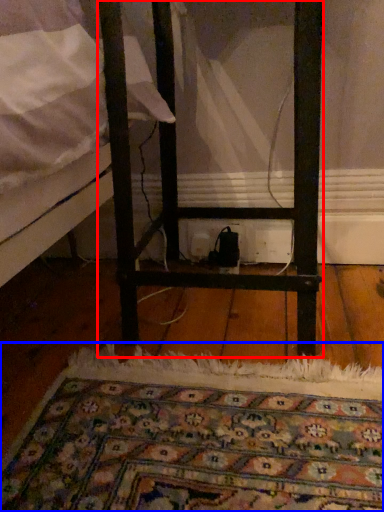
Question: Which object appears farthest to the camera in this image, furniture (highlighted by a red box) or mat (highlighted by a blue box)?

Choices:
 (A) furniture
 (B) mat

Answer: (A)